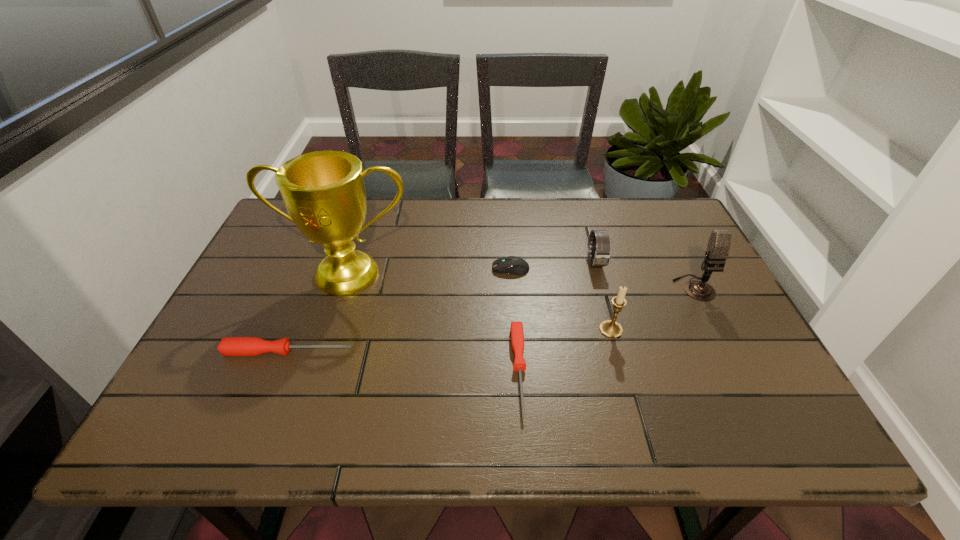
The image size is (960, 540). In order to click on empty location between the left screwdriver and the computer equipment in this screenshot , I will do `click(399, 310)`.

Where is `blank region between the left screwdriver and the candle holder`? The image size is (960, 540). blank region between the left screwdriver and the candle holder is located at coordinates (450, 341).

Locate an element on the screen. The image size is (960, 540). free space between the tallest object and the fourth tallest object is located at coordinates (472, 268).

Where is `free space between the third tallest object and the award`? free space between the third tallest object and the award is located at coordinates (480, 302).

Locate an element on the screen. unoccupied area between the fourth shortest object and the candle holder is located at coordinates (603, 296).

Where is `free area in between the taller screwdriver and the shortest object`? The image size is (960, 540). free area in between the taller screwdriver and the shortest object is located at coordinates (404, 361).

Where is `the closest object to the computer equipment`? The width and height of the screenshot is (960, 540). the closest object to the computer equipment is located at coordinates (600, 252).

Locate which object ranks second in proximity to the tallest object. Please provide its 2D coordinates. Your answer should be formatted as a tuple, i.e. [(x, y)], where the tuple contains the x and y coordinates of a point satisfying the conditions above.

[(514, 265)]

I want to click on free space that satisfies the following two spatial constraints: 1. on the shiny surface of the award; 2. at the tip of the taller screwdriver, so click(324, 352).

The image size is (960, 540). In order to click on vacant space that satisfies the following two spatial constraints: 1. on the face of the fourth shortest object; 2. on the button of the computer equipment in this screenshot , I will do coord(597,268).